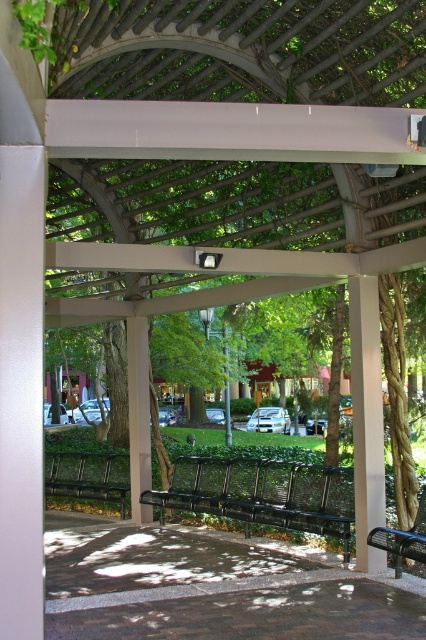
You are standing in the outdoor seating area under the wooden pergola. There are two points marked in the image. From your perspective, which point is closer to you, point (x=319, y=525) or point (x=69, y=476)?

Point (x=319, y=525) is closer to the viewer than point (x=69, y=476).

You are planning to place a new potted plant between the black mesh bench at center and the metallic silver bench at lower right. Based on their positions, where should the plant be placed to ensure it is between both benches?

The black mesh bench at center is located below the metallic silver bench at lower right. To place the plant between them, position it in the space between the lower black mesh bench and the upper metallic silver bench.